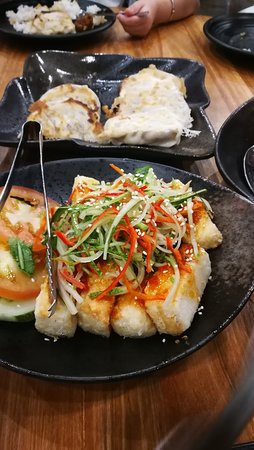
Where is `fork`? This screenshot has height=450, width=254. fork is located at coordinates [46, 215].